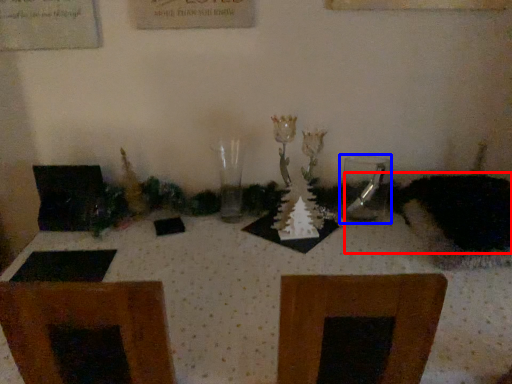
Question: Which object appears farthest to the camera in this image, animal (highlighted by a red box) or tableware (highlighted by a blue box)?

Choices:
 (A) animal
 (B) tableware

Answer: (B)